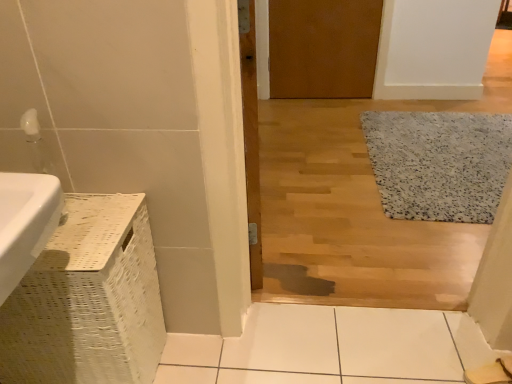
I want to click on wooden door at center, the 2th door viewed from the right, so click(x=251, y=136).

Which object is closer to the camera, wooden door at center, which is the 1th door in bottom-to-top order, or white speckled rug at right?

wooden door at center, which is the 1th door in bottom-to-top order.

Is point (246, 119) farther from camera compared to point (456, 205)?

No, it is in front of (456, 205).

Can you confirm if wooden door at center, the 2th door viewed from the right, is wider than white speckled rug at right?

In fact, wooden door at center, the 2th door viewed from the right, might be narrower than white speckled rug at right.

Can you confirm if wooden door at center, which is the 2th door in top-to-bottom order, is positioned to the left of white speckled rug at right?

Correct, you'll find wooden door at center, which is the 2th door in top-to-bottom order, to the left of white speckled rug at right.

How many degrees apart are the facing directions of brown matte door at upper center, marked as the second door in a left-to-right arrangement, and white speckled rug at right?

The angle between the facing direction of brown matte door at upper center, marked as the second door in a left-to-right arrangement, and the facing direction of white speckled rug at right is 0.000219 degrees.

Identify the location of bath mat on the right of brown matte door at upper center, which ranks as the second door in front-to-back order. This screenshot has width=512, height=384. (439, 163).

From a real-world perspective, who is located higher, brown matte door at upper center, which ranks as the second door in front-to-back order, or white speckled rug at right?

brown matte door at upper center, which ranks as the second door in front-to-back order.

Does brown matte door at upper center, placed as the 1th door when sorted from top to bottom, have a greater width compared to white speckled rug at right?

No.

Considering the positions of objects wooden door at center, acting as the first door starting from the left, and brown matte door at upper center, the 1th door positioned from the right, in the image provided, who is more to the left, wooden door at center, acting as the first door starting from the left, or brown matte door at upper center, the 1th door positioned from the right,?

From the viewer's perspective, wooden door at center, acting as the first door starting from the left, appears more on the left side.

Is wooden door at center, which is the 1th door from front to back, facing towards brown matte door at upper center, marked as the second door in a left-to-right arrangement?

No, wooden door at center, which is the 1th door from front to back, is not oriented towards brown matte door at upper center, marked as the second door in a left-to-right arrangement.

How different are the orientations of wooden door at center, which is the 1th door in bottom-to-top order, and brown matte door at upper center, placed as the 1th door when sorted from top to bottom, in degrees?

112 degrees.

Based on the photo, considering their positions, is wooden door at center, acting as the first door starting from the left, located in front of or behind brown matte door at upper center, the 1th door positioned from the right?

wooden door at center, acting as the first door starting from the left, is positioned closer to the viewer than brown matte door at upper center, the 1th door positioned from the right.

Where is `bath mat below the wooden door at center, the 2th door viewed from the right (from a real-world perspective)`? Image resolution: width=512 pixels, height=384 pixels. bath mat below the wooden door at center, the 2th door viewed from the right (from a real-world perspective) is located at coordinates (439, 163).

Is white speckled rug at right far away from wooden door at center, which is the 1th door in bottom-to-top order?

Yes.

Does point (460, 185) come behind point (250, 136)?

Yes, it is.

How far apart are white speckled rug at right and wooden door at center, acting as the first door starting from the left?

white speckled rug at right and wooden door at center, acting as the first door starting from the left, are 3.82 feet apart.

From a real-world perspective, relative to wooden door at center, the 2th door viewed from the right, is brown matte door at upper center, the 1th door positioned from the right, vertically above or below?

brown matte door at upper center, the 1th door positioned from the right, is situated lower than wooden door at center, the 2th door viewed from the right, in the real world.

Between brown matte door at upper center, which ranks as the second door in front-to-back order, and wooden door at center, acting as the first door starting from the left, which one appears on the right side from the viewer's perspective?

brown matte door at upper center, which ranks as the second door in front-to-back order, is more to the right.

Which object is closer to the camera taking this photo, brown matte door at upper center, the 1th door positioned from the right, or wooden door at center, acting as the first door starting from the left?

wooden door at center, acting as the first door starting from the left, is more forward.

Would you say white speckled rug at right is a long distance from brown matte door at upper center, the second door in the bottom-to-top sequence?

That's not correct — white speckled rug at right is a little close to brown matte door at upper center, the second door in the bottom-to-top sequence.

Could you tell me if white speckled rug at right is facing brown matte door at upper center, marked as the second door in a left-to-right arrangement?

No, white speckled rug at right is not oriented towards brown matte door at upper center, marked as the second door in a left-to-right arrangement.

Between point (460, 180) and point (360, 23), which one is positioned in front?

The point (460, 180) is more forward.

Where is `the 2nd door to the left of the white speckled rug at right, starting your count from the anchor`? This screenshot has height=384, width=512. the 2nd door to the left of the white speckled rug at right, starting your count from the anchor is located at coordinates (251, 136).

Identify the location of bath mat below the brown matte door at upper center, marked as the second door in a left-to-right arrangement (from the image's perspective). The height and width of the screenshot is (384, 512). (439, 163).

From the image, which object appears to be nearer to white speckled rug at right, wooden door at center, which is the 1th door in bottom-to-top order, or brown matte door at upper center, the 1th door positioned from the right?

Among the two, brown matte door at upper center, the 1th door positioned from the right, is located nearer to white speckled rug at right.

Which object lies further to the anchor point wooden door at center, which is the 1th door from front to back, brown matte door at upper center, the first door positioned from the back, or white speckled rug at right?

white speckled rug at right.

Looking at the image, which one is located further to wooden door at center, acting as the first door starting from the left, white speckled rug at right or brown matte door at upper center, placed as the 1th door when sorted from top to bottom?

Based on the image, white speckled rug at right appears to be further to wooden door at center, acting as the first door starting from the left.

From the image, which object appears to be farther from brown matte door at upper center, the 1th door positioned from the right, white speckled rug at right or wooden door at center, acting as the first door starting from the left?

wooden door at center, acting as the first door starting from the left, lies further to brown matte door at upper center, the 1th door positioned from the right, than the other object.

Based on their spatial positions, is wooden door at center, which is the 2th door in top-to-bottom order, or white speckled rug at right closer to brown matte door at upper center, the first door positioned from the back?

Based on the image, white speckled rug at right appears to be nearer to brown matte door at upper center, the first door positioned from the back.

Estimate the real-world distances between objects in this image. Which object is further from white speckled rug at right, brown matte door at upper center, the first door positioned from the back, or wooden door at center, which is the 1th door in bottom-to-top order?

wooden door at center, which is the 1th door in bottom-to-top order.

Find the location of a particular element. Image resolution: width=512 pixels, height=384 pixels. bath mat between wooden door at center, which is the 2th door in top-to-bottom order, and brown matte door at upper center, the 1th door positioned from the right, from front to back is located at coordinates (439, 163).